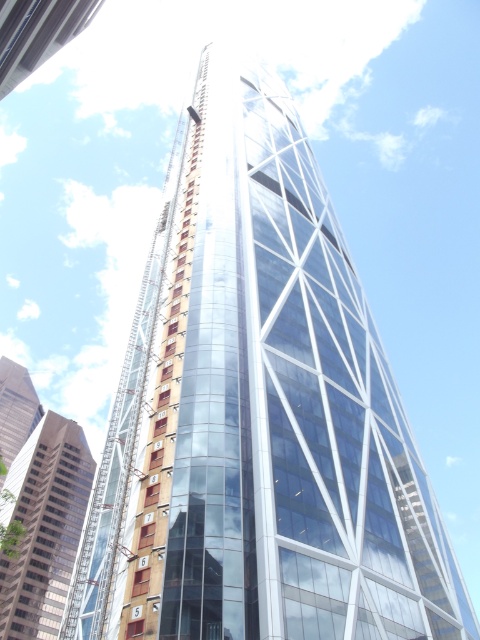
Looking at this image, you are an architect examining the construction site of a modern skyscraper. You notice the glassy reflective building at lower left and the transparent glass tower at upper left. Which one is positioned lower in the image?

The glassy reflective building at lower left is positioned lower than the transparent glass tower at upper left.

You are standing in front of a construction site and see the glassy reflective building at lower left and the transparent glass tower at upper left. Which one is positioned more to the left side?

The glassy reflective building at lower left is positioned more to the left side than the transparent glass tower at upper left.